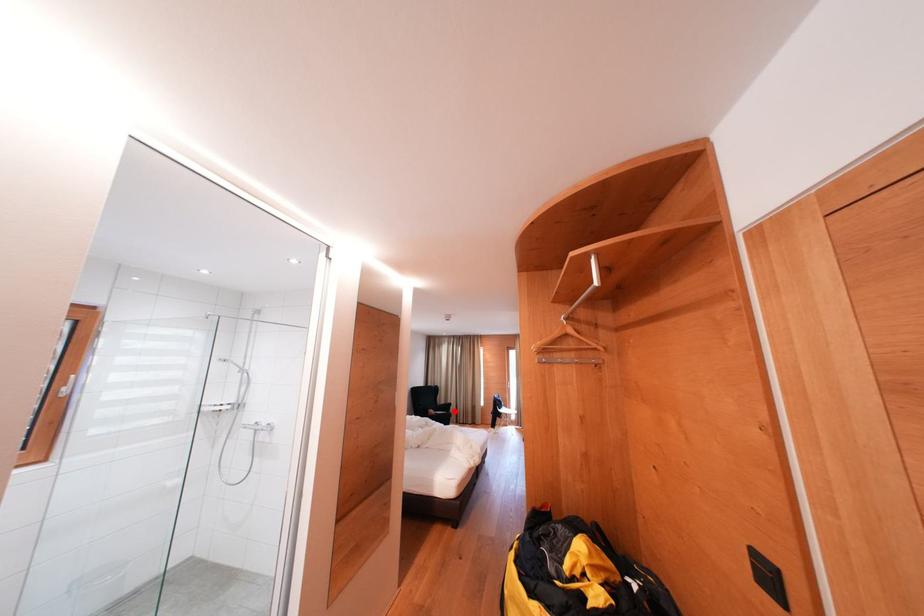
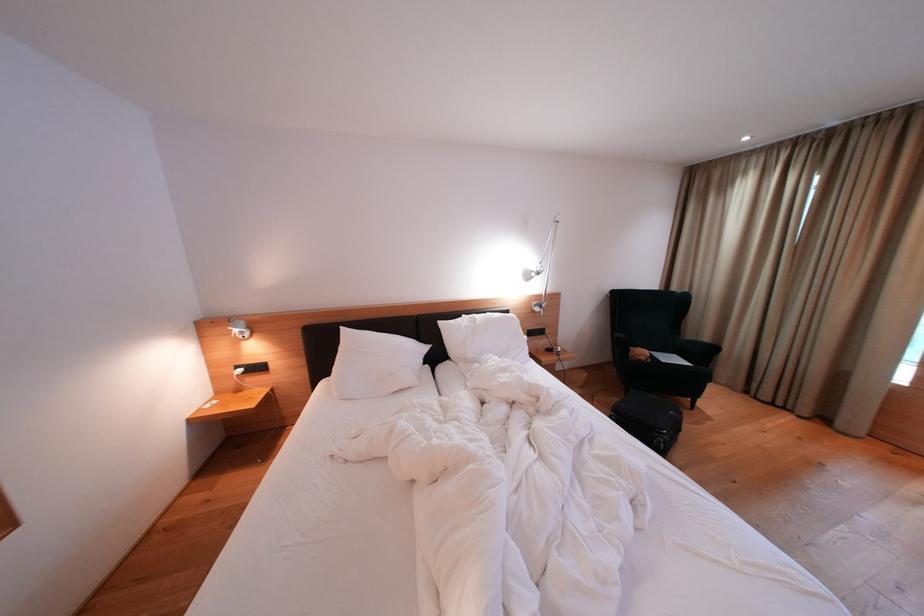
Question: I am providing you with two images of the same scene from different viewpoints. Image1 has a red point marked. In image2, the corresponding 3D location appears at what relative position? Reply with the corresponding letter.

Choices:
 (A) Closer
 (B) Farther

Answer: (A)